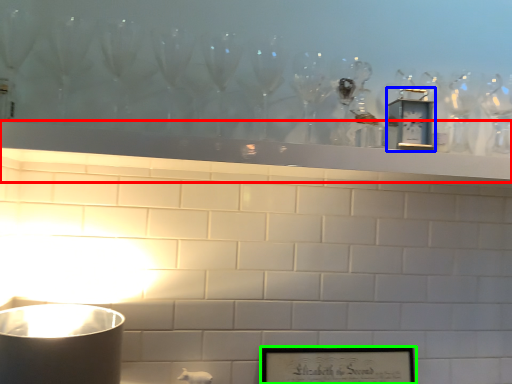
Question: Which object is positioned farthest from mantle (highlighted by a red box)? Select from clock (highlighted by a blue box) and picture frame (highlighted by a green box).

Choices:
 (A) clock
 (B) picture frame

Answer: (B)